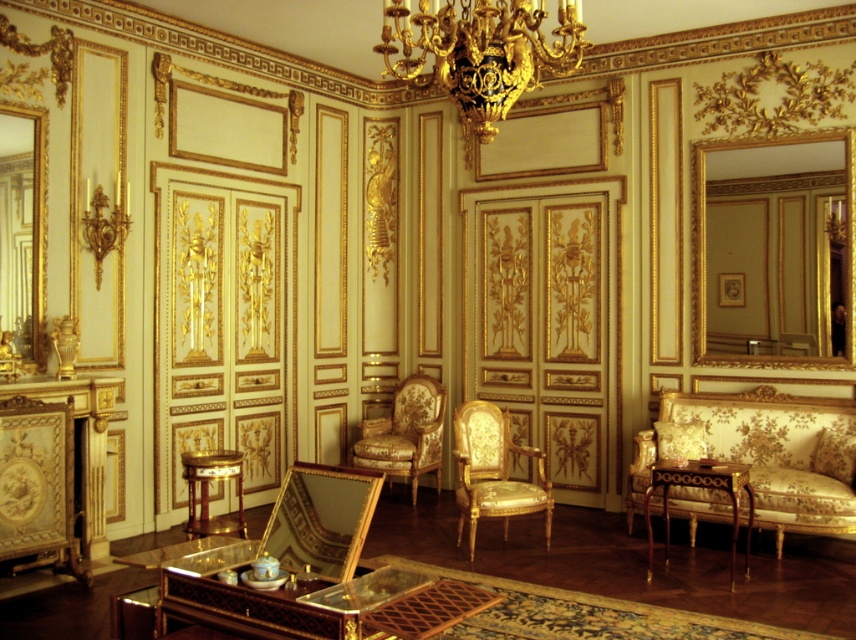
Consider the image. Is gold-patterned fabric sofa at right thinner than gold floral-patterned armchair at center?

No.

Can you confirm if gold-patterned fabric sofa at right is positioned to the left of gold floral-patterned armchair at center?

Incorrect, gold-patterned fabric sofa at right is not on the left side of gold floral-patterned armchair at center.

Image resolution: width=856 pixels, height=640 pixels. What are the coordinates of `gold-patterned fabric sofa at right` in the screenshot? It's located at (777, 452).

Does gold ornate chandelier at upper center have a greater height compared to gold floral-patterned armchair at center?

No.

Where is `gold ornate chandelier at upper center`? This screenshot has width=856, height=640. gold ornate chandelier at upper center is located at coordinates (480, 51).

Between point (562, 65) and point (361, 422), which one is positioned in front?

Positioned in front is point (562, 65).

Where is `gold ornate chandelier at upper center`? This screenshot has width=856, height=640. gold ornate chandelier at upper center is located at coordinates (480, 51).

This screenshot has height=640, width=856. In order to click on gold/carved wood armchair at center in this screenshot , I will do `click(492, 470)`.